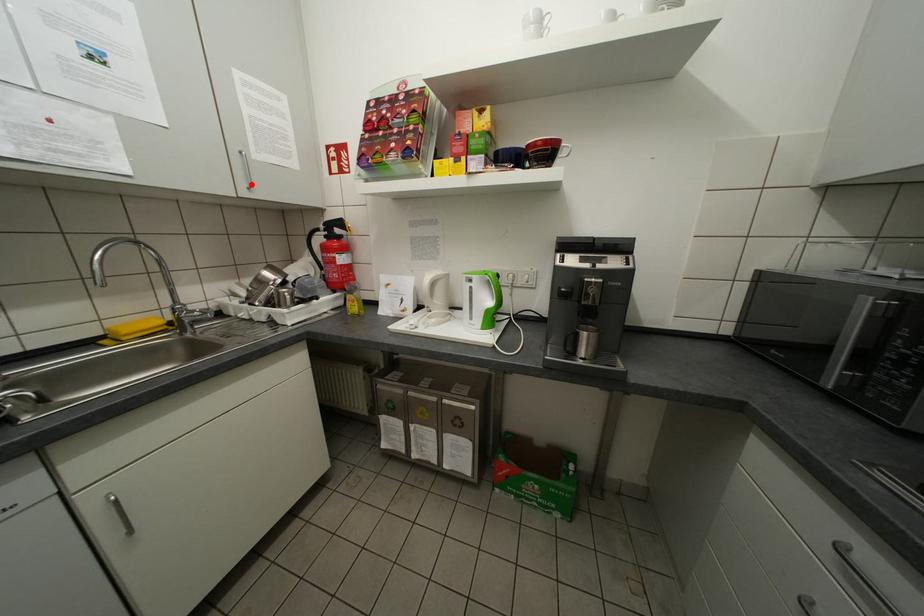
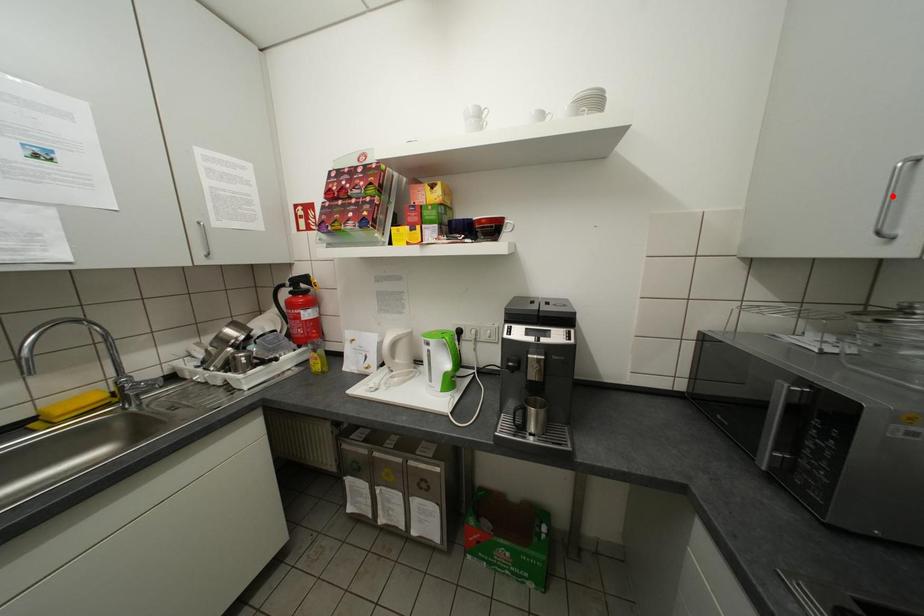
I am providing you with two images of the same scene from different viewpoints. A red point is marked on the first image and another point is marked on the second image. Is the marked point in image1 the same physical position as the marked point in image2?

No